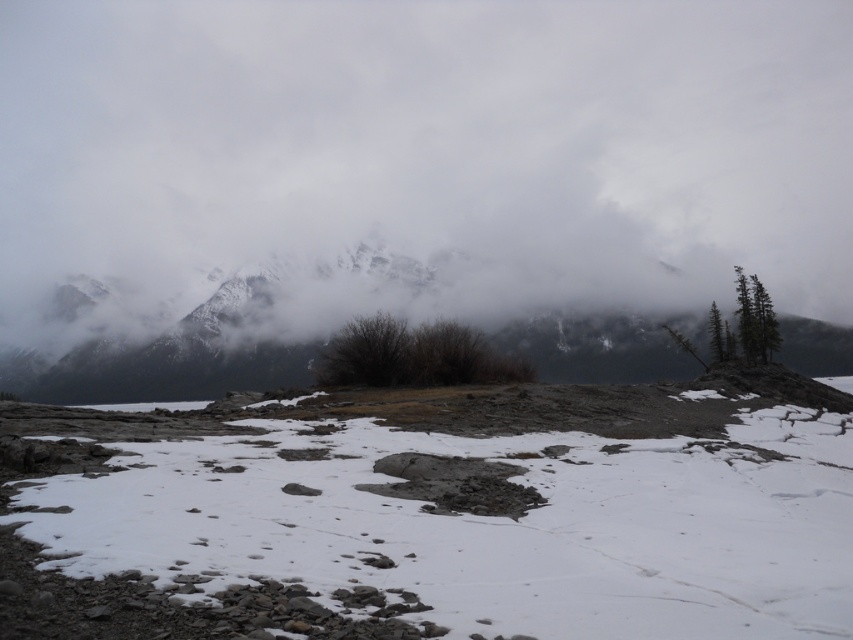
Question: Considering the real-world distances, which object is closest to the white powdery snow at center?

Choices:
 (A) brown dry bush at center
 (B) white fluffy cloud at upper center

Answer: (A)

Question: Which of the following is the closest to the observer?

Choices:
 (A) white powdery snow at center
 (B) white fluffy cloud at upper center
 (C) brown dry bush at center

Answer: (A)

Question: Which point is closer to the camera?

Choices:
 (A) brown dry bush at center
 (B) green matte tree at right
 (C) white powdery snow at center

Answer: (C)

Question: Is white powdery snow at center bigger than green matte tree at right?

Choices:
 (A) no
 (B) yes

Answer: (A)

Question: Is white powdery snow at center further to camera compared to green matte tree at right?

Choices:
 (A) yes
 (B) no

Answer: (B)

Question: Does white powdery snow at center appear under green matte tree at right?

Choices:
 (A) no
 (B) yes

Answer: (B)